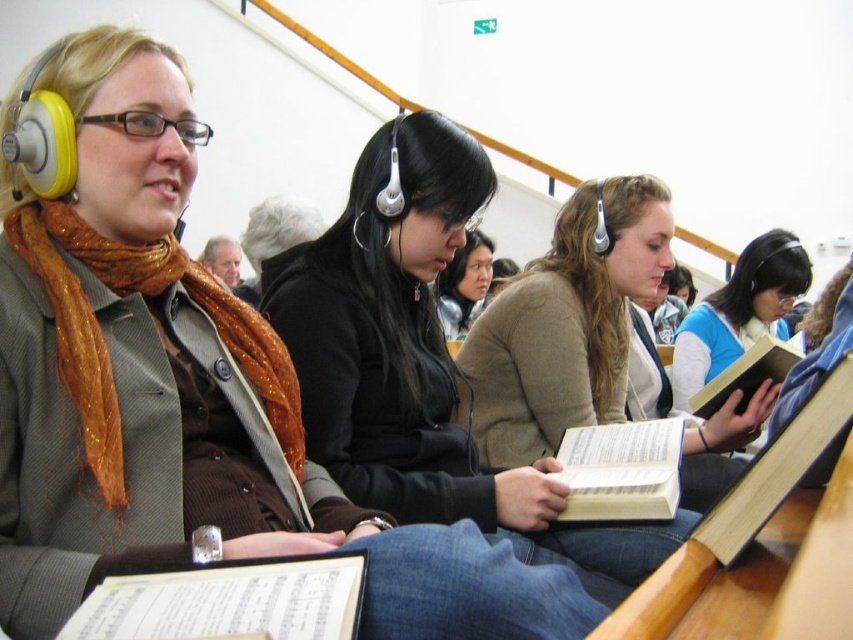
Question: Among these points, which one is farthest from the camera?

Choices:
 (A) (219, 614)
 (B) (454, 312)

Answer: (B)

Question: Observing the image, what is the correct spatial positioning of black matte jacket at center in reference to light brown sweater at center?

Choices:
 (A) right
 (B) left

Answer: (B)

Question: Is white paper book at lower left wider than white paper book at center?

Choices:
 (A) yes
 (B) no

Answer: (B)

Question: Where is black matte jacket at center located in relation to blue matte shirt at center in the image?

Choices:
 (A) right
 (B) left

Answer: (B)

Question: Which point is closer to the camera?

Choices:
 (A) black matte jacket at center
 (B) matte black jacket at center
 (C) hardcover book at center

Answer: (A)

Question: Which point is farther to the camera?

Choices:
 (A) (482, 291)
 (B) (254, 609)
 (C) (782, 374)

Answer: (A)